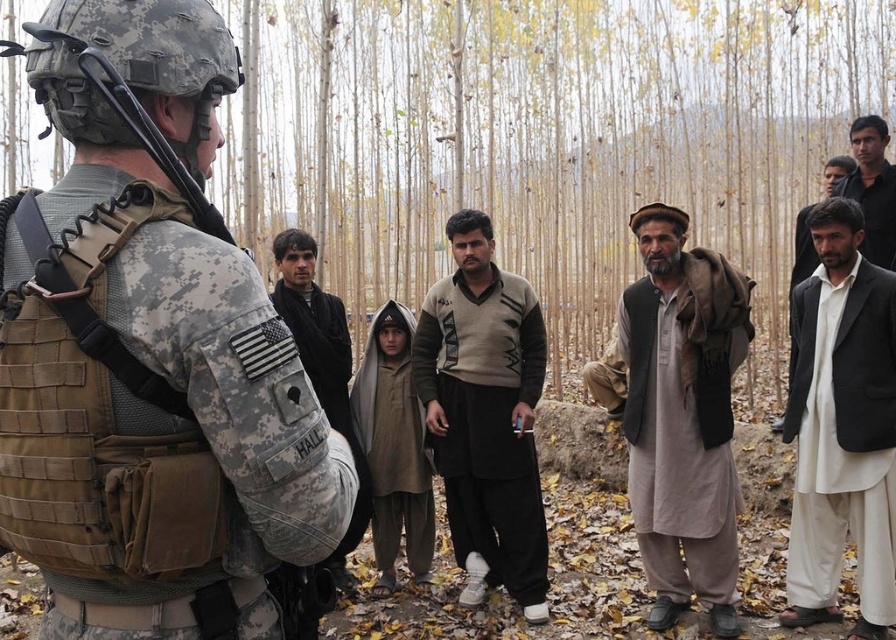
Which is more to the left, camouflage uniform at center or beige sweater at center?

camouflage uniform at center

I want to click on camouflage uniform at center, so click(x=151, y=362).

Which is in front, point (313, 292) or point (877, 177)?

Positioned in front is point (313, 292).

Locate an element on the screen. The image size is (896, 640). dark brown wool sweater at center is located at coordinates (322, 368).

Is white cotton kurta at right smaller than beige sweater at center?

Yes.

Is point (862, 234) farther from viewer compared to point (475, 580)?

No.

You are a GUI agent. You are given a task and a screenshot of the screen. Output one action in this format:
    pyautogui.click(x=<x>, y=<y>)
    Task: Click on the white cotton kurta at right
    
    Given the screenshot: What is the action you would take?
    pyautogui.click(x=841, y=428)